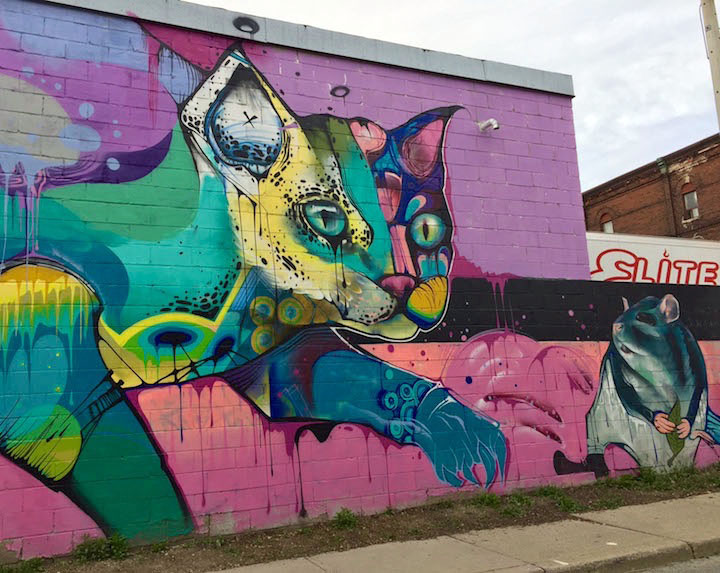
This screenshot has height=573, width=720. Identify the location of mouse. (657, 392).